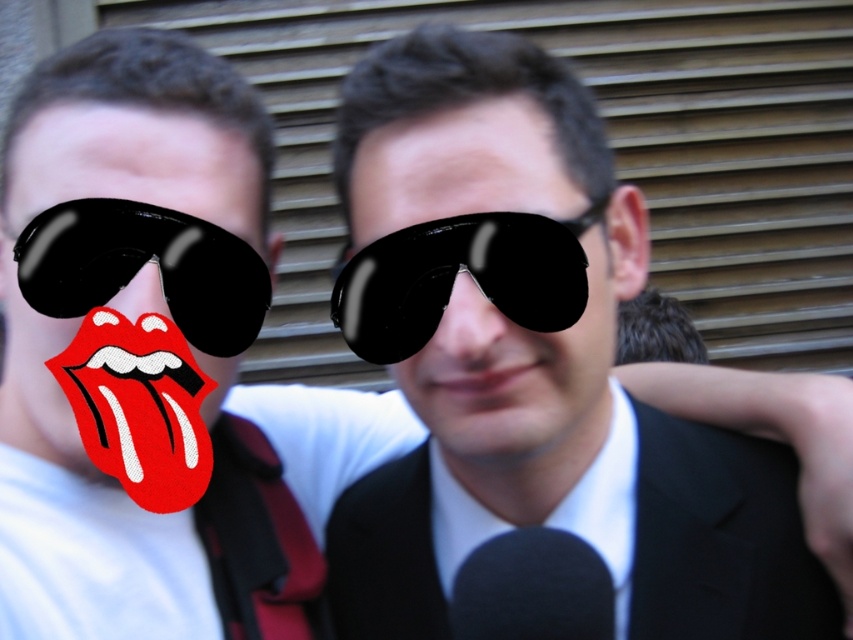
Is point (392, 260) positioned behind point (492, 374)?

Yes, point (392, 260) is behind point (492, 374).

In order to click on black glossy sunglasses at center in this screenshot , I will do `click(456, 275)`.

From the picture: Which is above, red glossy tongue at center or burgundy satin tie at center?

red glossy tongue at center is higher up.

Which is behind, point (54, 348) or point (219, 472)?

Point (219, 472)

The height and width of the screenshot is (640, 853). I want to click on red glossy tongue at center, so click(x=106, y=195).

Is burgundy satin tie at center positioned behind black glossy tongue at center?

Yes.

Can you confirm if burgundy satin tie at center is smaller than black glossy tongue at center?

No, burgundy satin tie at center is not smaller than black glossy tongue at center.

Locate an element on the screen. The height and width of the screenshot is (640, 853). burgundy satin tie at center is located at coordinates (258, 541).

Locate an element on the screen. The height and width of the screenshot is (640, 853). burgundy satin tie at center is located at coordinates 258,541.